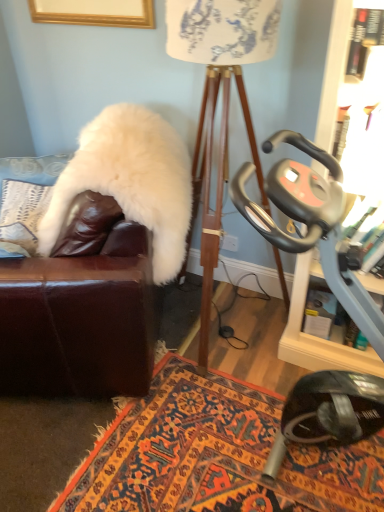
What is the approximate width of white fabric lampshade at center?

It is 21.85 inches.

Locate an element on the screen. The width and height of the screenshot is (384, 512). white fabric lampshade at center is located at coordinates (222, 102).

What is the approximate width of carpeted rug at center?

It is 1.46 meters.

This screenshot has width=384, height=512. What are the coordinates of `white fluffy pillow at upper left` in the screenshot? It's located at (22, 212).

Where is `white fabric lampshade at center`? This screenshot has width=384, height=512. white fabric lampshade at center is located at coordinates (222, 102).

Considering the sizes of objects white fluffy fur coat at left and metallic gray stationary bike at right in the image provided, who is shorter, white fluffy fur coat at left or metallic gray stationary bike at right?

With less height is white fluffy fur coat at left.

Is white fluffy fur coat at left not close to metallic gray stationary bike at right?

white fluffy fur coat at left is near metallic gray stationary bike at right, not far away.

Is white fluffy fur coat at left oriented towards metallic gray stationary bike at right?

No, white fluffy fur coat at left is not aimed at metallic gray stationary bike at right.

Which object is positioned more to the left, white fluffy fur coat at left or metallic gray stationary bike at right?

Positioned to the left is white fluffy fur coat at left.

Does white fluffy fur coat at left touch white fluffy pillow at upper left?

No, white fluffy fur coat at left is not with white fluffy pillow at upper left.

Can you confirm if white fluffy fur coat at left is thinner than white fluffy pillow at upper left?

In fact, white fluffy fur coat at left might be wider than white fluffy pillow at upper left.

How much distance is there between white fluffy fur coat at left and white fluffy pillow at upper left?

They are 23.44 inches apart.

From the image's perspective, which is below, white fluffy fur coat at left or white fluffy pillow at upper left?

white fluffy pillow at upper left.

From a real-world perspective, which object rests below the other?

white fluffy pillow at upper left, from a real-world perspective.

Between point (5, 226) and point (243, 102), which one is positioned behind?

The point (243, 102) is behind.

Consider the image. Is white fluffy pillow at upper left oriented away from white fabric lampshade at center?

white fluffy pillow at upper left is not turned away from white fabric lampshade at center.

Considering the sizes of white fluffy pillow at upper left and white fabric lampshade at center in the image, is white fluffy pillow at upper left taller or shorter than white fabric lampshade at center?

Considering their sizes, white fluffy pillow at upper left has less height than white fabric lampshade at center.

Does metallic gray stationary bike at right have a lesser height compared to white fabric lampshade at center?

Yes, metallic gray stationary bike at right is shorter than white fabric lampshade at center.

Looking at this image, measure the distance between metallic gray stationary bike at right and white fabric lampshade at center.

metallic gray stationary bike at right is 22.42 inches away from white fabric lampshade at center.

Which is more to the left, metallic gray stationary bike at right or white fabric lampshade at center?

From the viewer's perspective, white fabric lampshade at center appears more on the left side.

Identify the location of table lamp that is on the left side of metallic gray stationary bike at right. (222, 102).

From the image's perspective, which is below, white fabric lampshade at center or carpeted rug at center?

From the image's view, carpeted rug at center is below.

Considering the sizes of objects white fabric lampshade at center and carpeted rug at center in the image provided, who is bigger, white fabric lampshade at center or carpeted rug at center?

Bigger between the two is white fabric lampshade at center.

I want to click on table lamp located above the carpeted rug at center (from a real-world perspective), so click(x=222, y=102).

In terms of height, does white fabric lampshade at center look taller or shorter compared to carpeted rug at center?

Clearly, white fabric lampshade at center is taller compared to carpeted rug at center.

Is carpeted rug at center looking in the opposite direction of white fabric lampshade at center?

That's not correct — carpeted rug at center is not looking away from white fabric lampshade at center.

From a real-world perspective, is carpeted rug at center on white fabric lampshade at center?

No, from a real-world perspective, carpeted rug at center is not above white fabric lampshade at center.

From the image's perspective, is carpeted rug at center located beneath white fabric lampshade at center?

Yes, from the image's perspective, carpeted rug at center is beneath white fabric lampshade at center.

Is point (35, 186) farther from viewer compared to point (303, 446)?

That is True.

Is white fluffy pillow at upper left wider than carpeted rug at center?

Incorrect, the width of white fluffy pillow at upper left does not surpass that of carpeted rug at center.

Based on the photo, visually, is white fluffy pillow at upper left positioned to the left or to the right of carpeted rug at center?

From the image, it's evident that white fluffy pillow at upper left is to the left of carpeted rug at center.

Is white fluffy pillow at upper left outside of carpeted rug at center?

white fluffy pillow at upper left is positioned outside carpeted rug at center.

Find the location of a particular element. The image size is (384, 512). stationary bicycle below the white fluffy fur coat at left (from the image's perspective) is located at coordinates (311, 223).

There is a white fluffy pillow at upper left. Where is `fur coat above it (from a real-world perspective)`? This screenshot has width=384, height=512. fur coat above it (from a real-world perspective) is located at coordinates (130, 181).

Considering their positions, is white fabric lampshade at center positioned further to carpeted rug at center than white fluffy pillow at upper left?

Among the two, white fluffy pillow at upper left is located further to carpeted rug at center.

Estimate the real-world distances between objects in this image. Which object is closer to metallic gray stationary bike at right, white fluffy fur coat at left or carpeted rug at center?

carpeted rug at center lies closer to metallic gray stationary bike at right than the other object.

Estimate the real-world distances between objects in this image. Which object is closer to white fluffy fur coat at left, carpeted rug at center or white fluffy pillow at upper left?

white fluffy pillow at upper left.

Looking at the image, which one is located closer to white fluffy fur coat at left, white fabric lampshade at center or metallic gray stationary bike at right?

Among the two, white fabric lampshade at center is located nearer to white fluffy fur coat at left.

Considering their positions, is metallic gray stationary bike at right positioned closer to white fluffy pillow at upper left than carpeted rug at center?

carpeted rug at center is closer to white fluffy pillow at upper left.

Estimate the real-world distances between objects in this image. Which object is closer to white fluffy pillow at upper left, white fluffy fur coat at left or carpeted rug at center?

Among the two, white fluffy fur coat at left is located nearer to white fluffy pillow at upper left.

When comparing their distances from white fabric lampshade at center, does metallic gray stationary bike at right or white fluffy fur coat at left seem further?

metallic gray stationary bike at right lies further to white fabric lampshade at center than the other object.

From the image, which object appears to be nearer to white fluffy pillow at upper left, carpeted rug at center or metallic gray stationary bike at right?

Based on the image, carpeted rug at center appears to be nearer to white fluffy pillow at upper left.

At what (x,y) coordinates should I click in order to perform the action: click on pillow that lies between white fabric lampshade at center and carpeted rug at center from top to bottom. Please return your answer as a coordinate pair (x, y). This screenshot has width=384, height=512. Looking at the image, I should click on point(22,212).

Locate an element on the screen. pillow that lies between white fluffy fur coat at left and carpeted rug at center from top to bottom is located at coordinates (22, 212).

Where is `fur coat located between white fluffy pillow at upper left and white fabric lampshade at center in the left-right direction`? fur coat located between white fluffy pillow at upper left and white fabric lampshade at center in the left-right direction is located at coordinates (130, 181).

The width and height of the screenshot is (384, 512). Identify the location of mat between white fluffy pillow at upper left and metallic gray stationary bike at right. (216, 455).